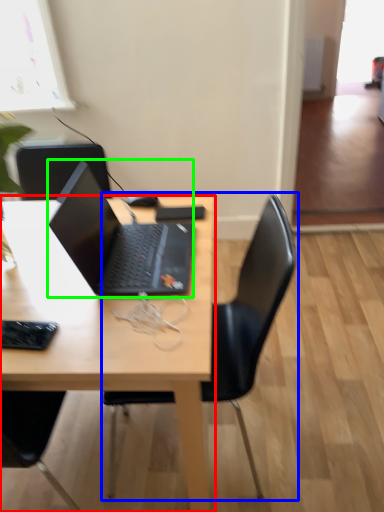
Question: Estimate the real-world distances between objects in this image. Which object is closer to desk (highlighted by a red box), chair (highlighted by a blue box) or laptop (highlighted by a green box)?

Choices:
 (A) chair
 (B) laptop

Answer: (B)